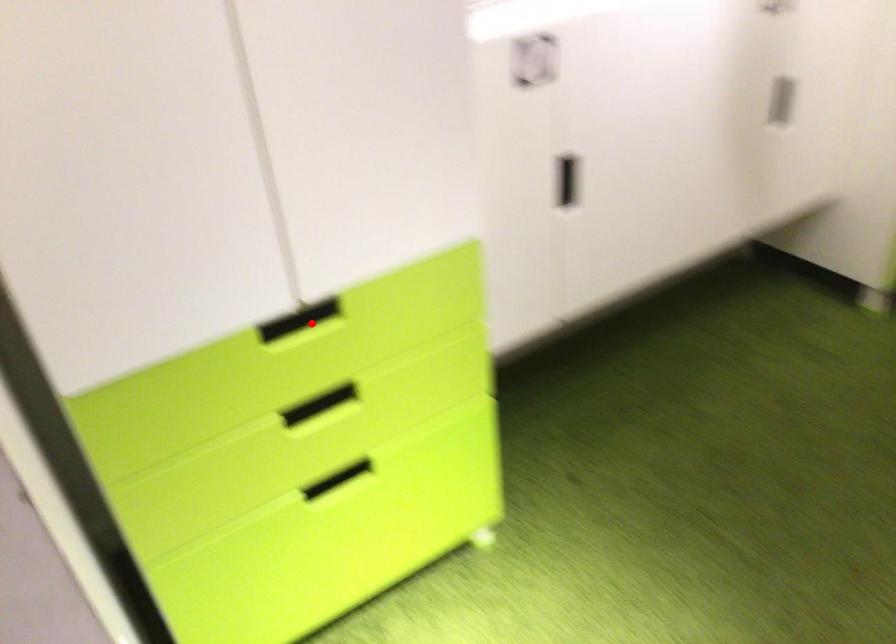
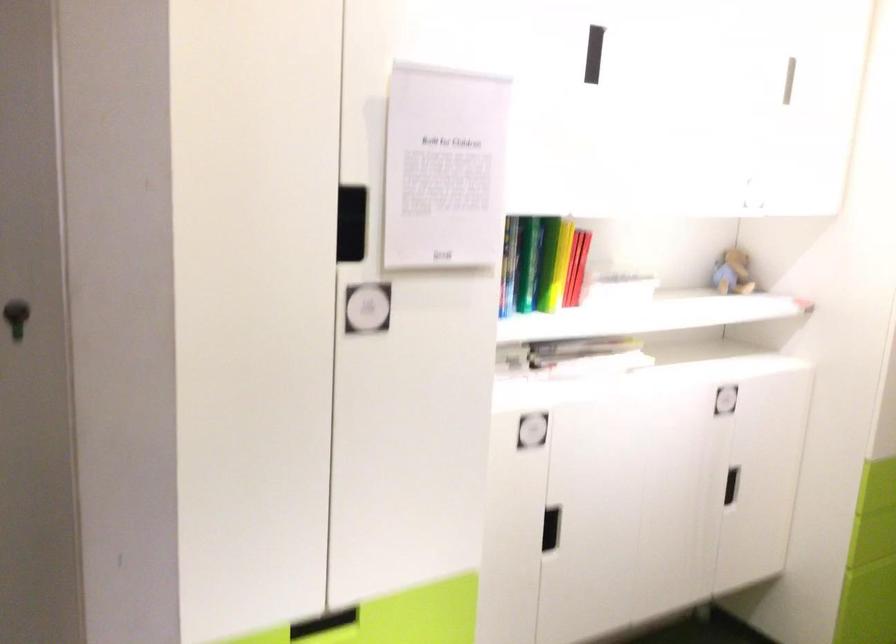
The point at the highlighted location is marked in the first image. Where is the corresponding point in the second image?

(323, 623)